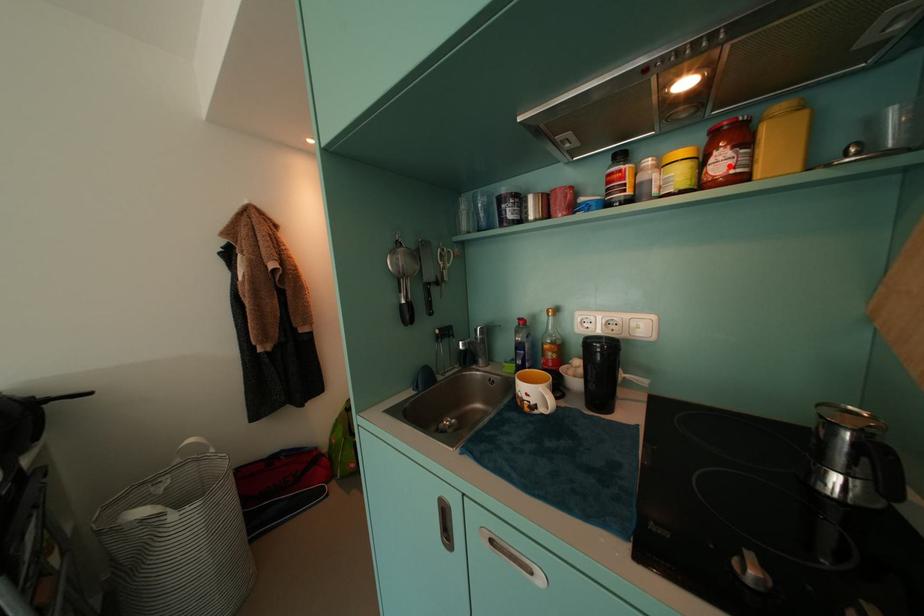
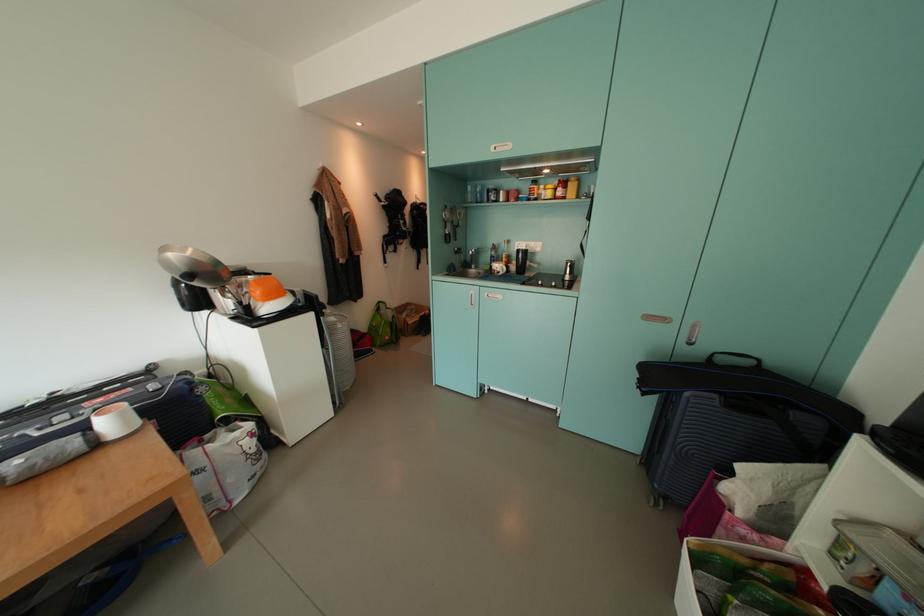
Question: I am providing you with two images of the same scene from different viewpoints. A red point is shown in image1. For the corresponding object point in image2, is it positioned nearer or farther from the camera?

Choices:
 (A) Nearer
 (B) Farther

Answer: (A)